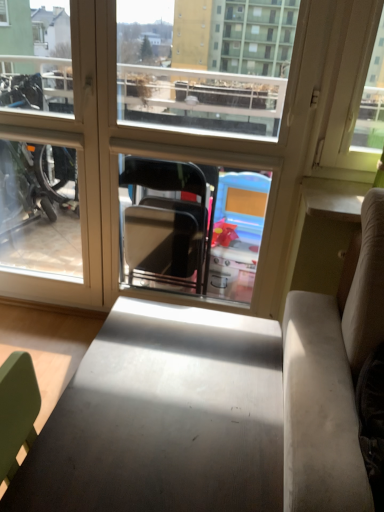
The image size is (384, 512). What do you see at coordinates (205, 143) in the screenshot? I see `transparent glass window at center` at bounding box center [205, 143].

Image resolution: width=384 pixels, height=512 pixels. Find the location of `transparent glass window at center`. transparent glass window at center is located at coordinates (205, 143).

What do you see at coordinates (164, 418) in the screenshot? I see `matte gray table at center` at bounding box center [164, 418].

This screenshot has height=512, width=384. In order to click on matte gray table at center in this screenshot , I will do [x=164, y=418].

You are a GUI agent. You are given a task and a screenshot of the screen. Output one action in this format:
    pyautogui.click(x=<x>, y=<y>)
    Task: Click on the transparent glass window at center
    The height and width of the screenshot is (512, 384).
    Given the screenshot: What is the action you would take?
    pyautogui.click(x=205, y=143)

From the picture: Is transparent glass window at center at the right side of matte gray table at center?

Incorrect, transparent glass window at center is not on the right side of matte gray table at center.

Between transparent glass window at center and matte gray table at center, which one is positioned behind?

transparent glass window at center is further from the camera.

Which point is more forward, (286, 231) or (121, 324)?

The point (121, 324) is closer.

From the image's perspective, which object appears higher, transparent glass window at center or matte gray table at center?

transparent glass window at center is shown above in the image.

Consider the image. From a real-world perspective, is transparent glass window at center positioned under matte gray table at center based on gravity?

Incorrect, from a real-world perspective, transparent glass window at center is higher than matte gray table at center.

Which object is thinner, transparent glass window at center or matte gray table at center?

With smaller width is transparent glass window at center.

Between transparent glass window at center and matte gray table at center, which one has less height?

matte gray table at center is shorter.

Can you confirm if transparent glass window at center is smaller than matte gray table at center?

Correct, transparent glass window at center occupies less space than matte gray table at center.

Is transparent glass window at center not within matte gray table at center?

Yes, transparent glass window at center is located beyond the bounds of matte gray table at center.

Is there a large distance between transparent glass window at center and matte gray table at center?

No, transparent glass window at center is in close proximity to matte gray table at center.

Based on the photo, is transparent glass window at center positioned with its back to matte gray table at center?

No, matte gray table at center is not at the back of transparent glass window at center.

What are the coordinates of `window located behind the matte gray table at center` in the screenshot? It's located at (205, 143).

Considering the positions of objects matte gray table at center and transparent glass window at center in the image provided, who is more to the left, matte gray table at center or transparent glass window at center?

transparent glass window at center is more to the left.

From the picture: Which object is closer to the camera taking this photo, matte gray table at center or transparent glass window at center?

Positioned in front is matte gray table at center.

Considering the positions of point (263, 447) and point (103, 42), is point (263, 447) closer or farther from the camera than point (103, 42)?

Clearly, point (263, 447) is closer to the camera than point (103, 42).

From the image's perspective, is matte gray table at center located above or below transparent glass window at center?

matte gray table at center is below transparent glass window at center.

From a real-world perspective, which is physically above, matte gray table at center or transparent glass window at center?

From a 3D spatial view, transparent glass window at center is above.

Between matte gray table at center and transparent glass window at center, which one has smaller width?

Thinner between the two is transparent glass window at center.

Considering the sizes of objects matte gray table at center and transparent glass window at center in the image provided, who is shorter, matte gray table at center or transparent glass window at center?

matte gray table at center.

Who is bigger, matte gray table at center or transparent glass window at center?

With larger size is matte gray table at center.

Choose the correct answer: Is matte gray table at center inside transparent glass window at center or outside it?

matte gray table at center is not enclosed by transparent glass window at center.

Would you consider matte gray table at center to be distant from transparent glass window at center?

That's not correct — matte gray table at center is a little close to transparent glass window at center.

Is matte gray table at center looking in the opposite direction of transparent glass window at center?

matte gray table at center does not have its back to transparent glass window at center.

The width and height of the screenshot is (384, 512). In the image, there is a transparent glass window at center. In order to click on table below it (from the image's perspective) in this screenshot , I will do `click(164, 418)`.

Find the location of a particular element. Image resolution: width=384 pixels, height=512 pixels. table below the transparent glass window at center (from the image's perspective) is located at coordinates (164, 418).

The width and height of the screenshot is (384, 512). In order to click on window that is on the left side of matte gray table at center in this screenshot , I will do `click(205, 143)`.